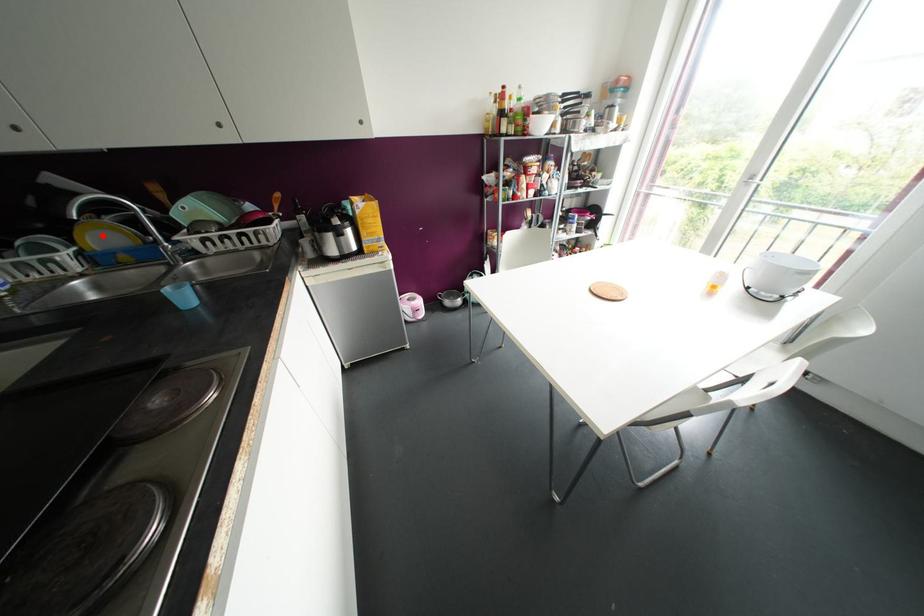
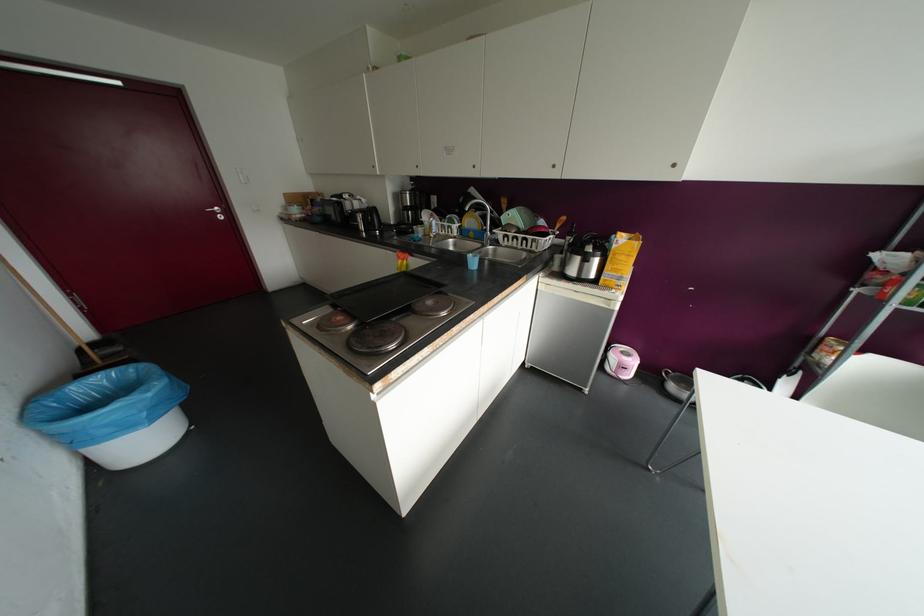
Question: I am providing you with two images of the same scene from different viewpoints. A red point is shown in image1. For the corresponding object point in image2, is it positioned nearer or farther from the camera?

Choices:
 (A) Nearer
 (B) Farther

Answer: (A)